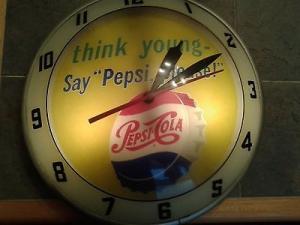
Find the location of a particular element. clock is located at coordinates (247, 77).